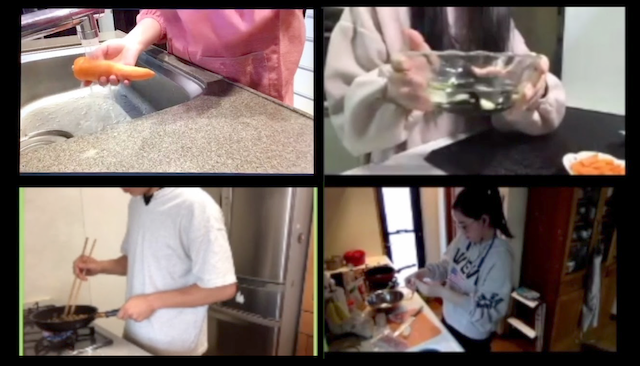
You are a GUI agent. You are given a task and a screenshot of the screen. Output one action in this format:
    pyautogui.click(x=<x>, y=<y>)
    Task: Click on the robe
    
    Given the screenshot: What is the action you would take?
    pyautogui.click(x=221, y=44), pyautogui.click(x=365, y=44)